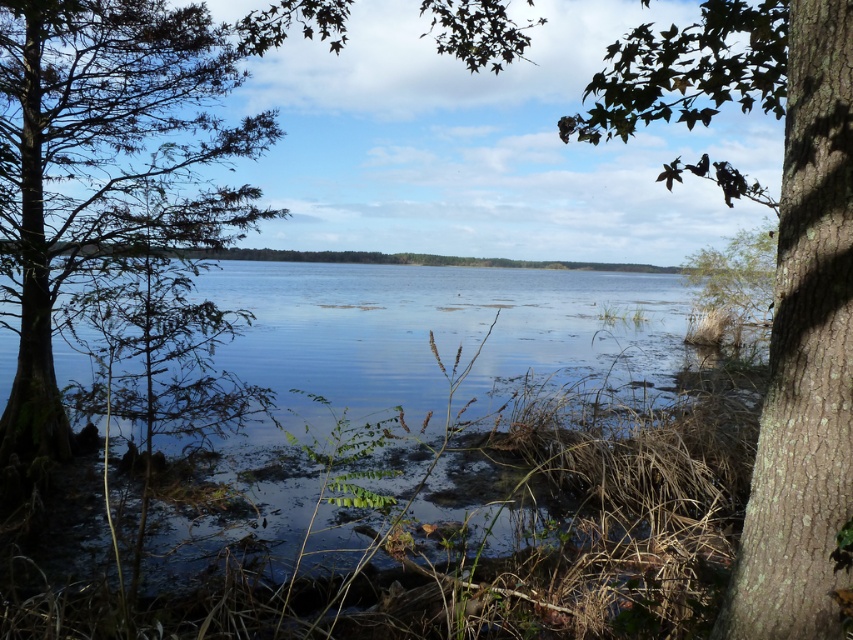
Which is below, brown rough bark tree at right or green mossy tree at left?

green mossy tree at left is lower down.

Is brown rough bark tree at right positioned in front of green mossy tree at left?

Yes.

Which is behind, point (810, 628) or point (177, 163)?

The point (177, 163) is behind.

Find the location of a particular element. Image resolution: width=853 pixels, height=640 pixels. brown rough bark tree at right is located at coordinates click(776, 269).

Can you confirm if clear water at center is positioned above brown rough bark tree at right?

Incorrect, clear water at center is not positioned above brown rough bark tree at right.

Which is more to the left, clear water at center or brown rough bark tree at right?

Positioned to the left is clear water at center.

Identify the location of clear water at center. The width and height of the screenshot is (853, 640). (416, 456).

The width and height of the screenshot is (853, 640). Describe the element at coordinates (416, 456) in the screenshot. I see `clear water at center` at that location.

Between clear water at center and green mossy tree at left, which one appears on the right side from the viewer's perspective?

clear water at center

Does point (390, 273) come farther from viewer compared to point (57, 225)?

Yes, point (390, 273) is farther from viewer.

Where is `clear water at center`? This screenshot has width=853, height=640. clear water at center is located at coordinates (416, 456).